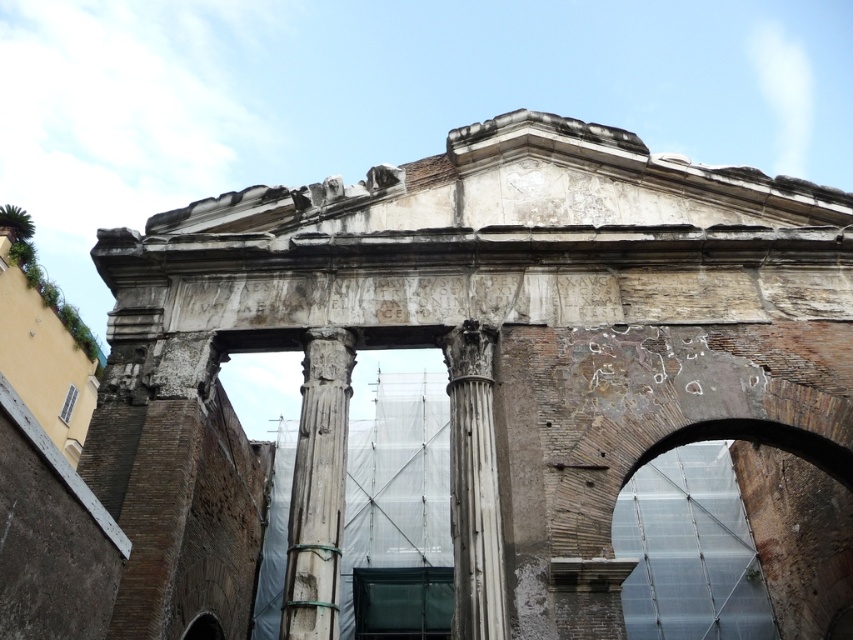
Can you confirm if white stone column at center is positioned above white marble column at center?

Yes.

The height and width of the screenshot is (640, 853). What do you see at coordinates (318, 486) in the screenshot?
I see `white stone column at center` at bounding box center [318, 486].

This screenshot has width=853, height=640. I want to click on white stone column at center, so click(x=318, y=486).

Is rusty metal arch at center wider than white marble column at center?

Correct, the width of rusty metal arch at center exceeds that of white marble column at center.

Does point (648, 486) come behind point (492, 588)?

Yes, it is.

This screenshot has height=640, width=853. Identify the location of rusty metal arch at center. (718, 540).

The height and width of the screenshot is (640, 853). Identify the location of rusty metal arch at center. (718, 540).

Can you confirm if rusty metal arch at center is positioned to the left of white stone column at center?

No, rusty metal arch at center is not to the left of white stone column at center.

Which is below, rusty metal arch at center or white stone column at center?

rusty metal arch at center is lower down.

Is point (664, 493) closer to camera compared to point (340, 525)?

No, it is behind (340, 525).

You are a GUI agent. You are given a task and a screenshot of the screen. Output one action in this format:
    pyautogui.click(x=<x>, y=<y>)
    Task: Click on the rusty metal arch at center
    
    Given the screenshot: What is the action you would take?
    pyautogui.click(x=718, y=540)